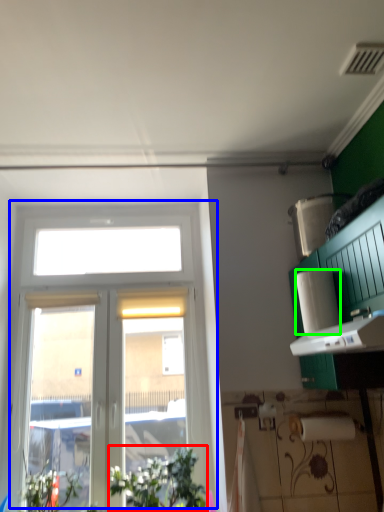
Question: Estimate the real-world distances between objects in this image. Which object is farther from plant (highlighted by a red box), window (highlighted by a blue box) or paper towel (highlighted by a green box)?

Choices:
 (A) window
 (B) paper towel

Answer: (B)